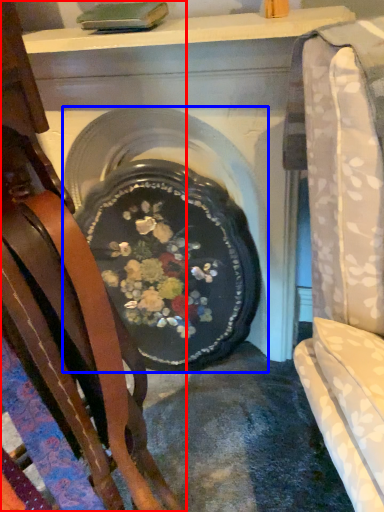
Question: Which object appears closest to the camera in this image, chair (highlighted by a red box) or fireplace (highlighted by a blue box)?

Choices:
 (A) chair
 (B) fireplace

Answer: (A)